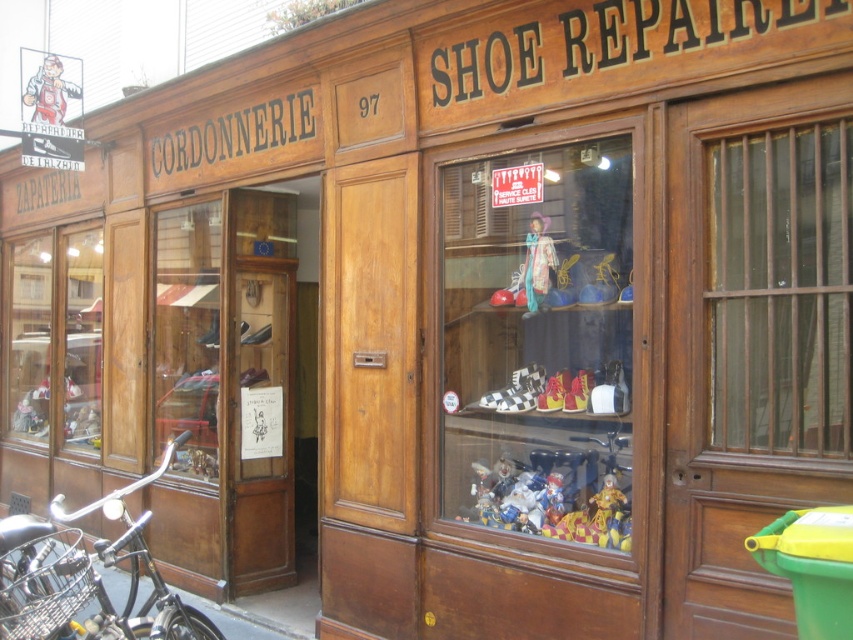
Which is above, matte glass shop window at center or black matte bicycle at lower left?

Positioned higher is matte glass shop window at center.

Is matte glass shop window at center positioned behind black matte bicycle at lower left?

Yes, it is behind black matte bicycle at lower left.

Is point (491, 180) positioned in front of point (12, 634)?

No, it is behind (12, 634).

Where is `matte glass shop window at center`? This screenshot has width=853, height=640. matte glass shop window at center is located at coordinates (538, 340).

Is matte glass shop window at center bigger than transparent glass window at right?

Correct, matte glass shop window at center is larger in size than transparent glass window at right.

Locate an element on the screen. The width and height of the screenshot is (853, 640). matte glass shop window at center is located at coordinates click(538, 340).

Describe the element at coordinates (538, 340) in the screenshot. This screenshot has width=853, height=640. I see `matte glass shop window at center` at that location.

Who is higher up, matte glass shop window at center or multicolored plastic clown at center?

matte glass shop window at center is above.

Does point (535, 362) come behind point (543, 483)?

Yes, it is.

Find the location of a particular element. The image size is (853, 640). matte glass shop window at center is located at coordinates (538, 340).